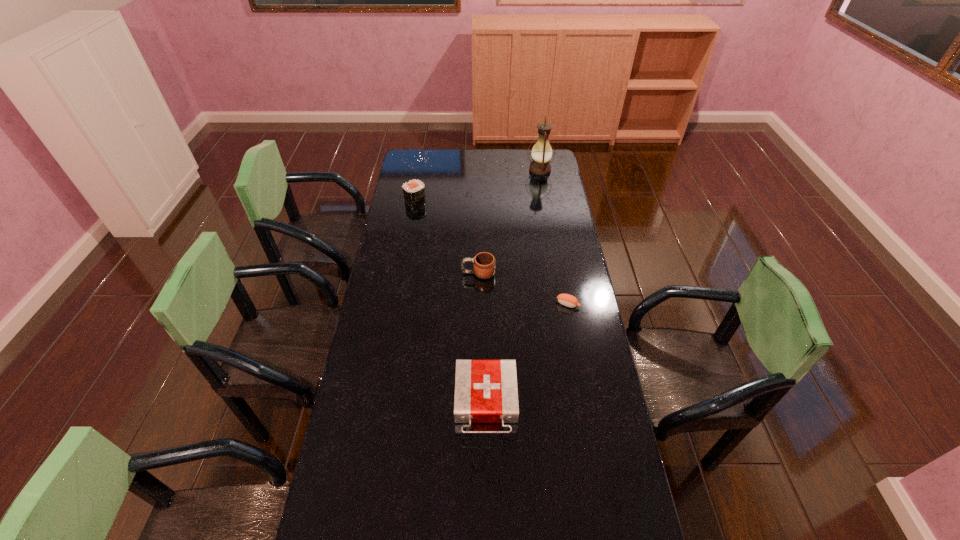
The height and width of the screenshot is (540, 960). I want to click on free area in between the shorter sushi and the tallest object, so click(554, 237).

Locate an element on the screen. free space between the second nearest object and the second shortest object is located at coordinates coord(527,353).

The width and height of the screenshot is (960, 540). Find the location of `free space that is in between the right sushi and the second shortest object`. free space that is in between the right sushi and the second shortest object is located at coordinates (527, 353).

Image resolution: width=960 pixels, height=540 pixels. Find the location of `vacant space that is in between the third nearest object and the left sushi`. vacant space that is in between the third nearest object and the left sushi is located at coordinates (446, 237).

The width and height of the screenshot is (960, 540). Identify the location of free space between the fourth tallest object and the farther sushi. (450, 301).

You are a GUI agent. You are given a task and a screenshot of the screen. Output one action in this format:
    pyautogui.click(x=<x>, y=<y>)
    Task: Click on the free spot between the fourth tallest object and the tallest object
    The height and width of the screenshot is (540, 960).
    Given the screenshot: What is the action you would take?
    pyautogui.click(x=513, y=286)

This screenshot has height=540, width=960. I want to click on object identified as the closest to the oil lamp, so click(414, 191).

Image resolution: width=960 pixels, height=540 pixels. In order to click on object that stands as the second closest to the farther sushi in this screenshot , I will do `click(541, 153)`.

Where is `free space that satisfies the following two spatial constraints: 1. on the back side of the oil lamp; 2. on the right side of the taller sushi`? The width and height of the screenshot is (960, 540). free space that satisfies the following two spatial constraints: 1. on the back side of the oil lamp; 2. on the right side of the taller sushi is located at coordinates (420, 170).

Where is `free spot that satisfies the following two spatial constraints: 1. on the side of the nearer sushi with the handle; 2. on the right side of the third farthest object`? free spot that satisfies the following two spatial constraints: 1. on the side of the nearer sushi with the handle; 2. on the right side of the third farthest object is located at coordinates (478, 304).